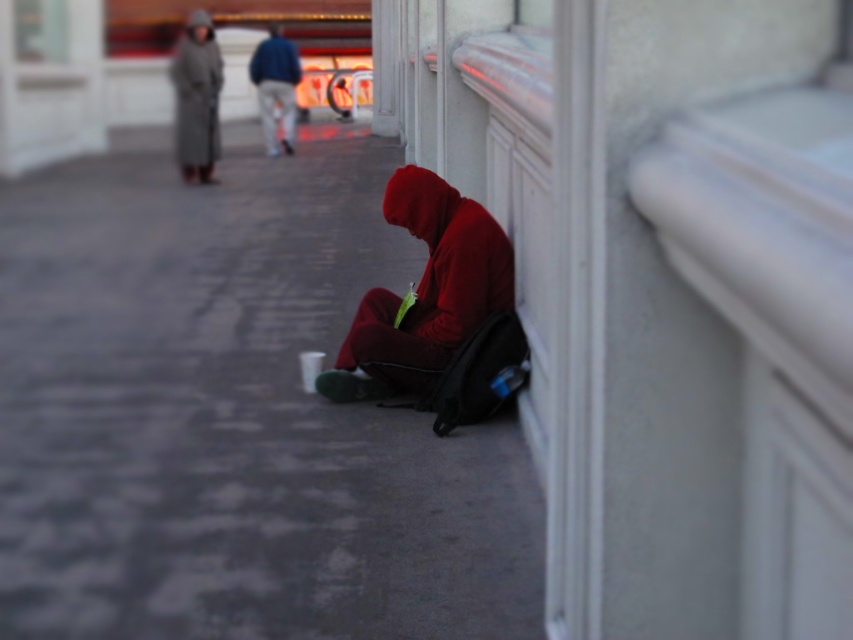
Question: Which point is farther from the camera taking this photo?

Choices:
 (A) (228, 224)
 (B) (430, 339)
 (C) (221, 72)

Answer: (C)

Question: In this image, where is gray concrete pavement at lower left located relative to matte red hoodie at center?

Choices:
 (A) right
 (B) left

Answer: (B)

Question: From the image, what is the correct spatial relationship of gray wool coat at upper left in relation to blue denim jeans at center?

Choices:
 (A) below
 (B) above

Answer: (A)

Question: Which point is farther to the camera?

Choices:
 (A) blue denim jeans at center
 (B) matte red hoodie at center

Answer: (A)

Question: From the image, what is the correct spatial relationship of gray wool coat at upper left in relation to blue denim jeans at center?

Choices:
 (A) below
 (B) above

Answer: (A)

Question: Which of the following is the closest to the observer?

Choices:
 (A) blue denim jeans at center
 (B) gray concrete pavement at lower left
 (C) gray wool coat at upper left

Answer: (B)